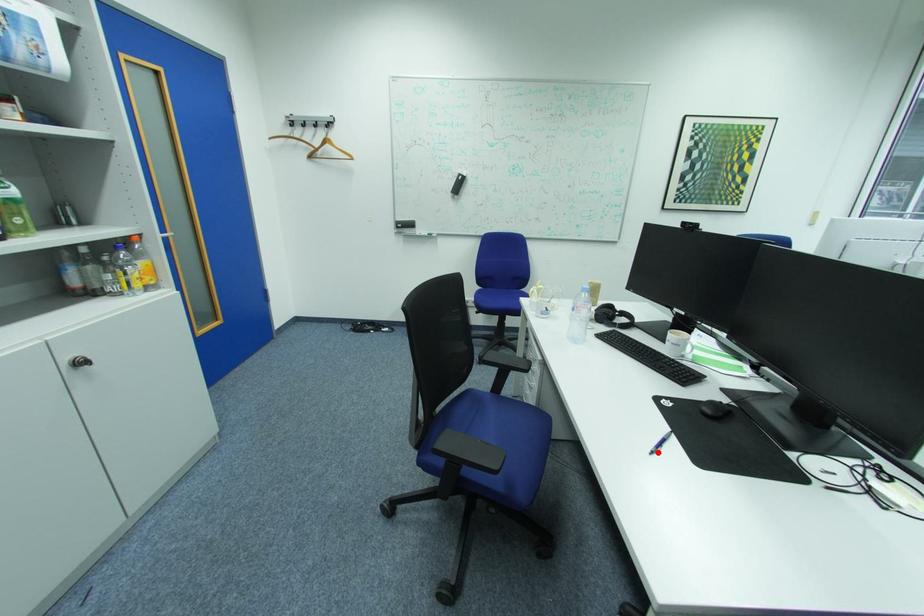
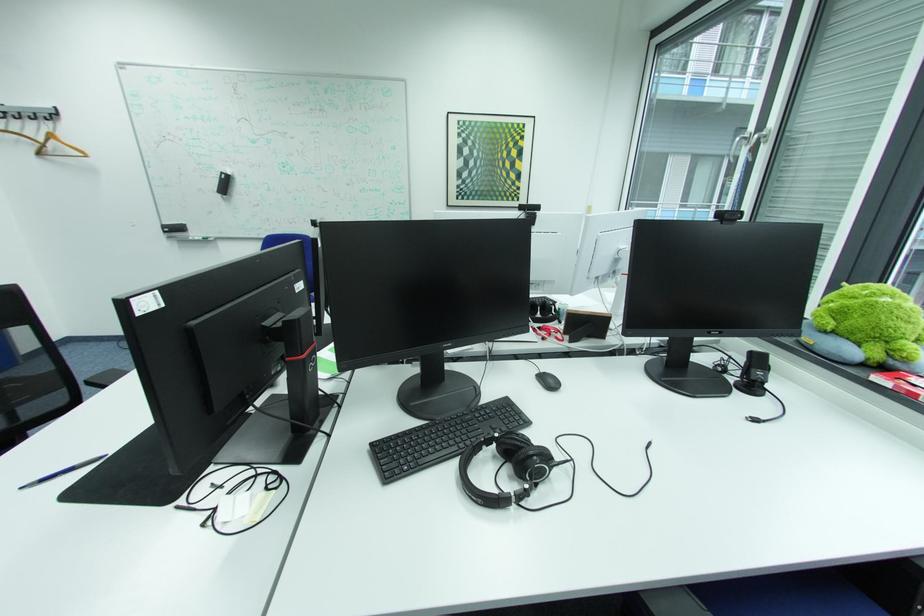
Question: I am providing you with two images of the same scene from different viewpoints. A red point is marked on the first image. At the location where the point appears in image 1, is it still visible in image 2?

Choices:
 (A) Yes
 (B) No

Answer: (A)